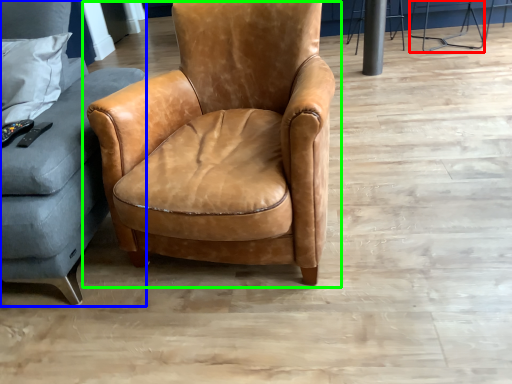
Question: Considering the real-world distances, which object is closest to bar stool (highlighted by a red box)? studio couch (highlighted by a blue box) or chair (highlighted by a green box).

Choices:
 (A) studio couch
 (B) chair

Answer: (B)